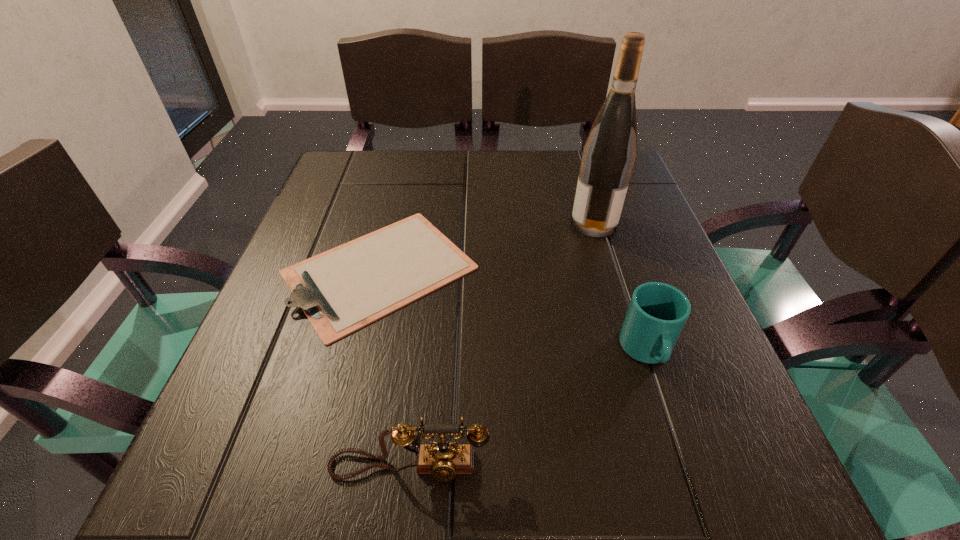
At what (x,y) coordinates should I click in order to perform the action: click on cup that is at the right edge. Please return your answer as a coordinate pair (x, y). This screenshot has height=540, width=960. Looking at the image, I should click on (657, 313).

You are a GUI agent. You are given a task and a screenshot of the screen. Output one action in this format:
    pyautogui.click(x=<x>, y=<y>)
    Task: Click on the vacant region at the far edge of the desktop
    
    Given the screenshot: What is the action you would take?
    pyautogui.click(x=466, y=150)

At what (x,y) coordinates should I click in order to perform the action: click on vacant space at the near edge of the desktop. Please return your answer as a coordinate pair (x, y). The height and width of the screenshot is (540, 960). Looking at the image, I should click on (633, 486).

Where is `vacant space at the left edge`? vacant space at the left edge is located at coordinates (274, 339).

Locate an element on the screen. vacant space at the right edge of the desktop is located at coordinates (689, 360).

I want to click on free space at the far left corner of the desktop, so click(x=325, y=200).

Locate an element on the screen. vacant space at the near left corner of the desktop is located at coordinates (228, 465).

Find the location of a particular element. Image resolution: width=960 pixels, height=540 pixels. free location at the near right corner of the desktop is located at coordinates (673, 515).

Where is `empty location between the telephone and the cup`? The height and width of the screenshot is (540, 960). empty location between the telephone and the cup is located at coordinates (528, 409).

Where is `free space between the telephone and the shortest object`? free space between the telephone and the shortest object is located at coordinates (395, 368).